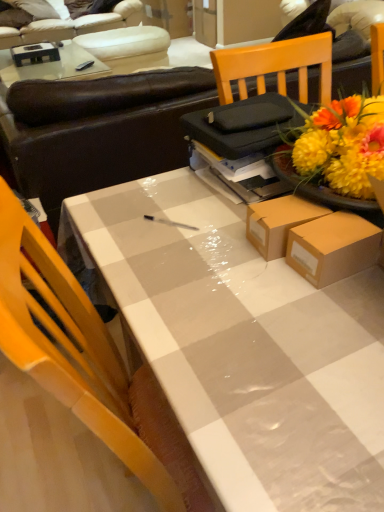
Question: From the image's perspective, is white leather couch at upper left, acting as the second studio couch starting from the front, over white glossy table at center?

Choices:
 (A) yes
 (B) no

Answer: (A)

Question: Is white leather couch at upper left, which ranks as the first studio couch in top-to-bottom order, placed right next to white glossy table at center?

Choices:
 (A) yes
 (B) no

Answer: (B)

Question: Is white leather couch at upper left, which is counted as the 1th studio couch, starting from the back, in front of white glossy table at center?

Choices:
 (A) no
 (B) yes

Answer: (A)

Question: Considering the relative sizes of white leather couch at upper left, the second studio couch positioned from the bottom, and white glossy table at center in the image provided, is white leather couch at upper left, the second studio couch positioned from the bottom, taller than white glossy table at center?

Choices:
 (A) yes
 (B) no

Answer: (B)

Question: Does white leather couch at upper left, acting as the second studio couch starting from the front, have a larger size compared to white glossy table at center?

Choices:
 (A) yes
 (B) no

Answer: (A)

Question: Is white glossy table at center taller or shorter than white leather armchair at upper left?

Choices:
 (A) tall
 (B) short

Answer: (A)

Question: From the image's perspective, is white glossy table at center located above or below white leather armchair at upper left?

Choices:
 (A) below
 (B) above

Answer: (A)

Question: Is point (165, 203) closer or farther from the camera than point (109, 34)?

Choices:
 (A) farther
 (B) closer

Answer: (B)

Question: Is white glossy table at center inside the boundaries of white leather armchair at upper left, or outside?

Choices:
 (A) inside
 (B) outside

Answer: (B)

Question: Is brown leather couch at upper center, arranged as the first studio couch when ordered from the bottom, taller or shorter than white leather couch at upper left, acting as the second studio couch starting from the front?

Choices:
 (A) short
 (B) tall

Answer: (B)

Question: From the image's perspective, is brown leather couch at upper center, arranged as the first studio couch when ordered from the bottom, located above or below white leather couch at upper left, which ranks as the first studio couch in top-to-bottom order?

Choices:
 (A) above
 (B) below

Answer: (B)

Question: In the image, is brown leather couch at upper center, the second studio couch viewed from the top, positioned in front of or behind white leather couch at upper left, which ranks as the first studio couch in top-to-bottom order?

Choices:
 (A) behind
 (B) front

Answer: (B)

Question: Is point (145, 115) positioned closer to the camera than point (129, 33)?

Choices:
 (A) farther
 (B) closer

Answer: (B)

Question: Looking at their shapes, would you say white leather couch at upper left, acting as the second studio couch starting from the front, is wider or thinner than brown leather couch at upper center, the second studio couch when ordered from back to front?

Choices:
 (A) thin
 (B) wide

Answer: (B)

Question: Is white leather couch at upper left, the second studio couch positioned from the bottom, spatially inside brown leather couch at upper center, arranged as the first studio couch when ordered from the bottom, or outside of it?

Choices:
 (A) inside
 (B) outside

Answer: (B)